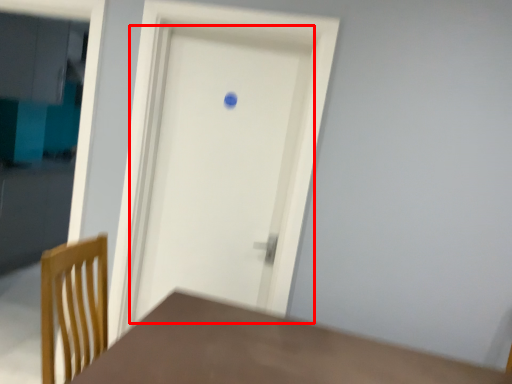
Question: From the image's perspective, where is door (annotated by the red box) located relative to table?

Choices:
 (A) above
 (B) below

Answer: (A)